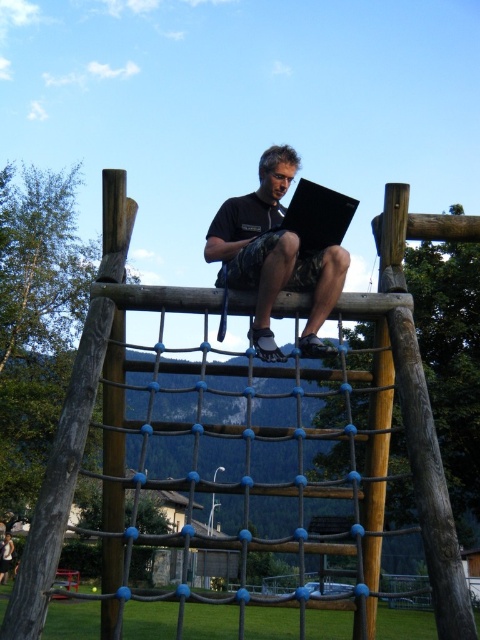
You are standing at the base of the climbing structure and want to place a small flag at the point closer to you. Which point should you choose between point (99, 323) and point (328, 193)?

You should choose point (99, 323) because it is closer to the camera than point (328, 193).